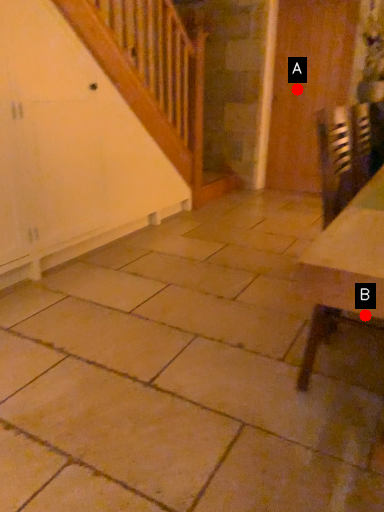
Question: Two points are circled on the image, labeled by A and B beside each circle. Which of the following is the closest to the observer?

Choices:
 (A) A is closer
 (B) B is closer

Answer: (B)